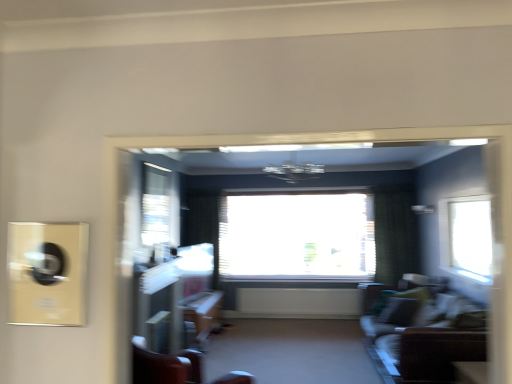
Question: Is transparent glass window at right, acting as the 1th window starting from the right, inside the boundaries of transparent glass window at upper center, which appears as the 2th window when viewed from the back, or outside?

Choices:
 (A) outside
 (B) inside

Answer: (A)

Question: Considering the relative positions of transparent glass window at right, arranged as the third window when viewed from the back, and transparent glass window at upper center, acting as the first window starting from the left, in the image provided, is transparent glass window at right, arranged as the third window when viewed from the back, to the left or to the right of transparent glass window at upper center, acting as the first window starting from the left,?

Choices:
 (A) right
 (B) left

Answer: (A)

Question: Which is nearer to the transparent glass window at center, marked as the second window in a right-to-left arrangement?

Choices:
 (A) transparent glass window at upper center, acting as the first window starting from the left
 (B) matte brown table at lower right, which is counted as the second table, starting from the left
 (C) matte gray carpet at center
 (D) velvet green sofa at lower right
 (E) wooden chair at center

Answer: (A)

Question: Which is nearer to the velvet green sofa at lower right?

Choices:
 (A) matte gray carpet at center
 (B) transparent glass window at right, arranged as the third window when viewed from the back
 (C) transparent glass window at upper center, the third window when ordered from right to left
 (D) matte brown table at lower right, which ranks as the 1th table in right-to-left order
 (E) wooden table at center, marked as the second table in a right-to-left arrangement

Answer: (B)